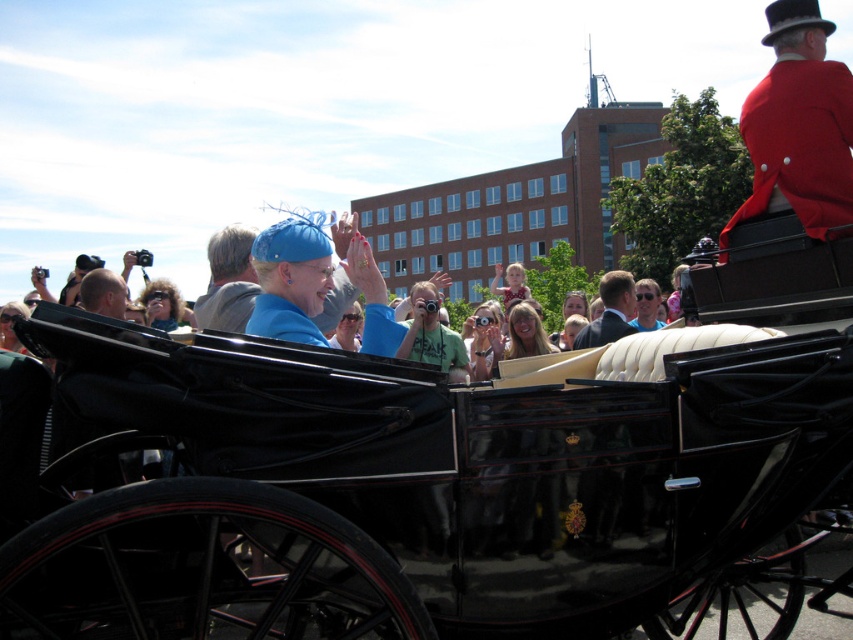
You are a photographer standing at the back of the scene. You want to take a photo of both the black polished wood horse cart at center and the matte blue hat at center. Which object should you focus on first to ensure both are in the frame?

The black polished wood horse cart at center is in front of the matte blue hat at center, so you should focus on the black polished wood horse cart at center first to ensure both are in the frame.